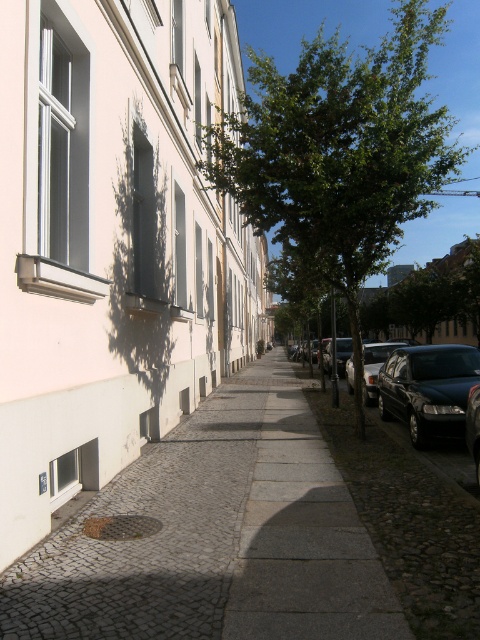
You are standing at the point with coordinates point (364,352) and want to walk to the point with coordinates point (186,516). Which direction should you move relative to your current position?

You should move forward because point (186,516) is in front of point (364,352).

You are standing on the sidewalk in the urban street scene. You notice two points marked on the ground ahead of you. The first point is at coordinates point (x=202, y=182) and the second is at point (x=396, y=381). Which point is closer to your current position?

Point (x=202, y=182) is closer to your current position because it is further to the camera than point (x=396, y=381), meaning it is nearer to the observer standing on the sidewalk.

You are a pedestrian standing on the sidewalk. You want to cross the street to reach the white smooth building at center. Is the shiny black sedan at right blocking your path?

The white smooth building at center is in front of the shiny black sedan at right, meaning the building is closer to you than the car. Therefore, the shiny black sedan at right is not blocking your path to the white smooth building at center.